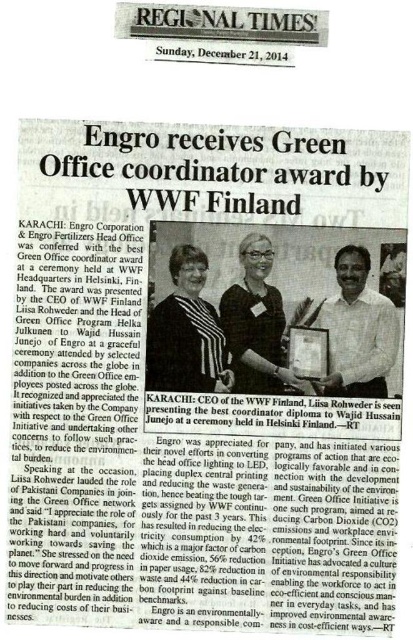
Who is more forward, (171, 340) or (372, 378)?

Point (171, 340) is in front.

Does black striped dress at center appear on the left side of white shirt at center?

Yes, black striped dress at center is to the left of white shirt at center.

The height and width of the screenshot is (640, 413). Describe the element at coordinates (187, 332) in the screenshot. I see `black striped dress at center` at that location.

Identify the location of black striped dress at center. (187, 332).

Which is in front, point (343, 342) or point (263, 369)?

Point (263, 369)

The width and height of the screenshot is (413, 640). What are the coordinates of `white shirt at center` in the screenshot? It's located at (358, 330).

At what (x,y) coordinates should I click in order to perform the action: click on white shirt at center. Please return your answer as a coordinate pair (x, y). The height and width of the screenshot is (640, 413). Looking at the image, I should click on (358, 330).

Can you confirm if black striped dress at center is shorter than matte black glasses at center?

Yes, black striped dress at center is shorter than matte black glasses at center.

Is point (149, 388) closer to camera compared to point (241, 305)?

No, (149, 388) is further to viewer.

At what (x,y) coordinates should I click in order to perform the action: click on black striped dress at center. Please return your answer as a coordinate pair (x, y). The image size is (413, 640). Looking at the image, I should click on (187, 332).

Image resolution: width=413 pixels, height=640 pixels. Identify the location of black striped dress at center. (187, 332).